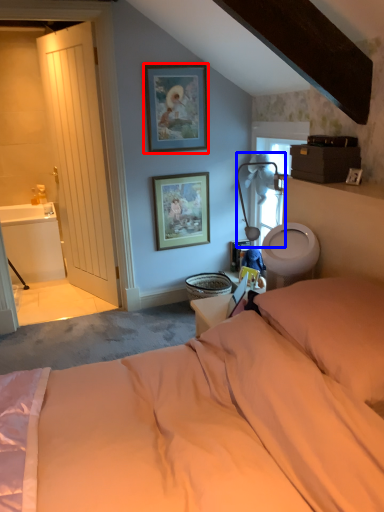
Question: Among these objects, which one is nearest to the camera, picture frame (highlighted by a red box) or table lamp (highlighted by a blue box)?

Choices:
 (A) picture frame
 (B) table lamp

Answer: (B)